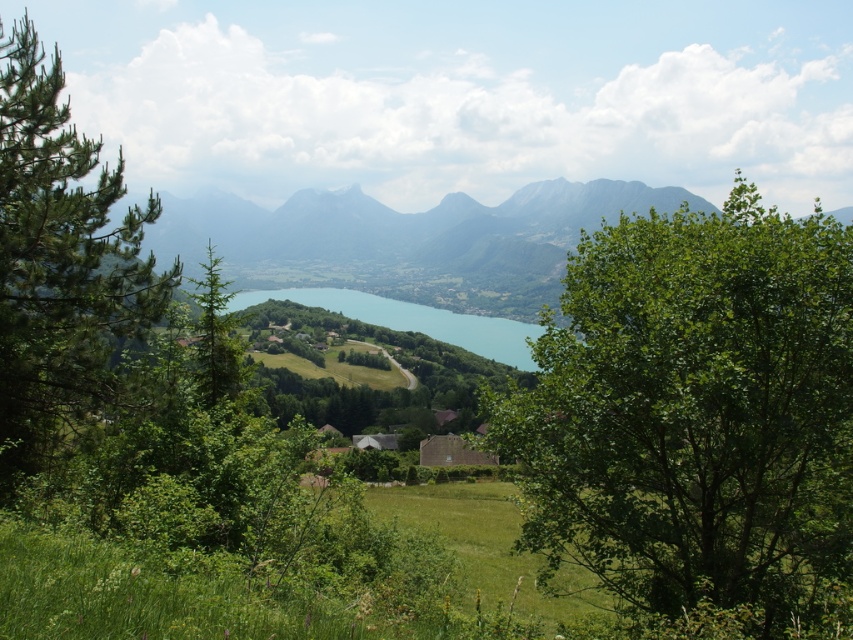
You are standing at the point marked as point (695, 413) in the image. What type of vegetation are you surrounded by?

You are surrounded by a green leafy tree at center.